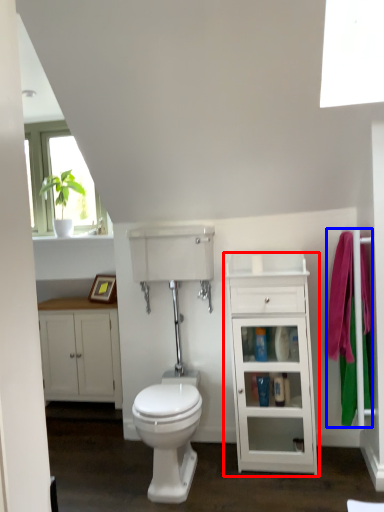
Question: Which of the following is the closest to the observer, cabinetry (highlighted by a red box) or bath towel (highlighted by a blue box)?

Choices:
 (A) cabinetry
 (B) bath towel

Answer: (B)